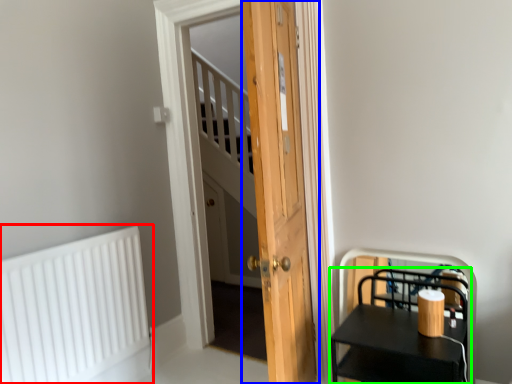
Question: Based on their relative distances, which object is farther from radiator (highlighted by a red box)? Choose from door (highlighted by a blue box) and furniture (highlighted by a green box).

Choices:
 (A) door
 (B) furniture

Answer: (B)